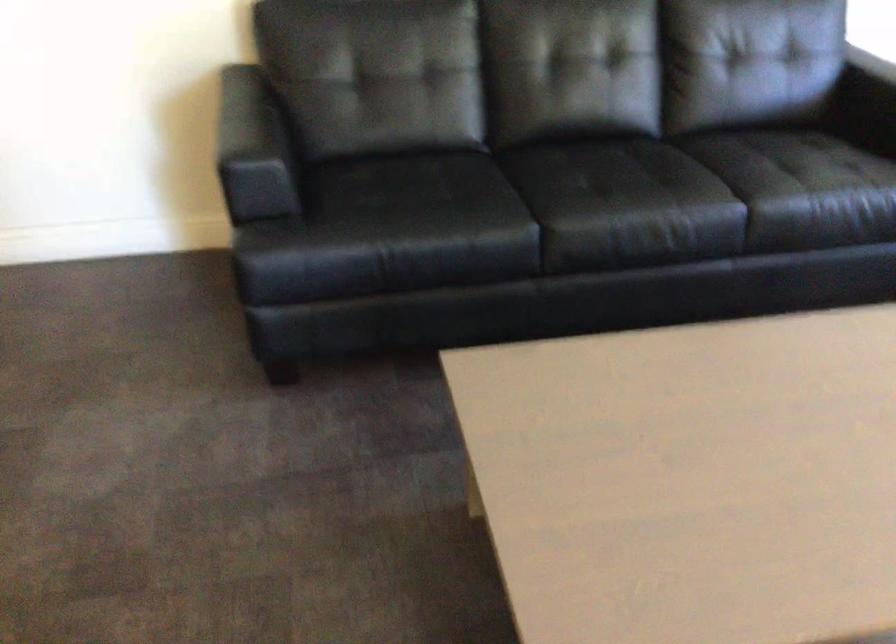
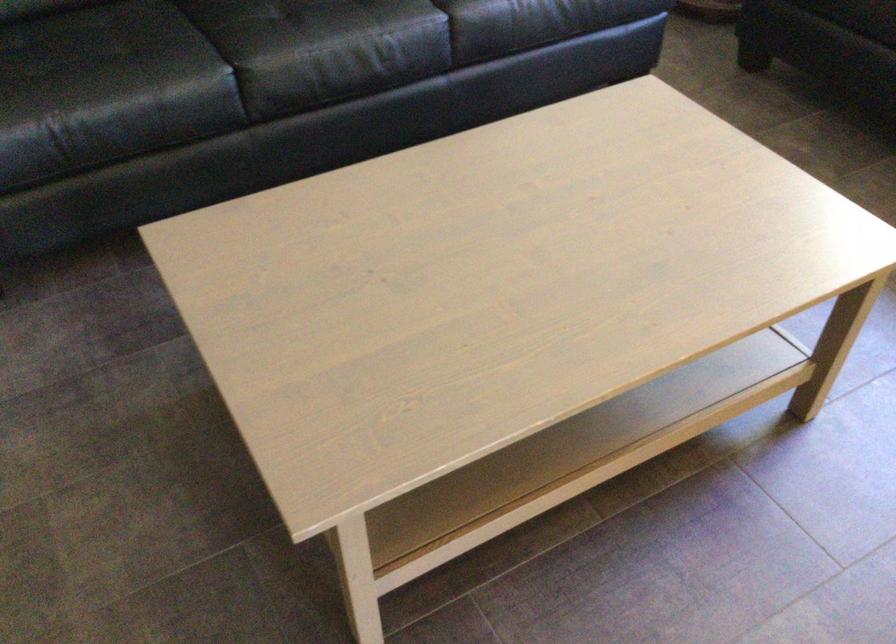
In the second image, find the point that corresponds to point 527,228 in the first image.

(221, 78)